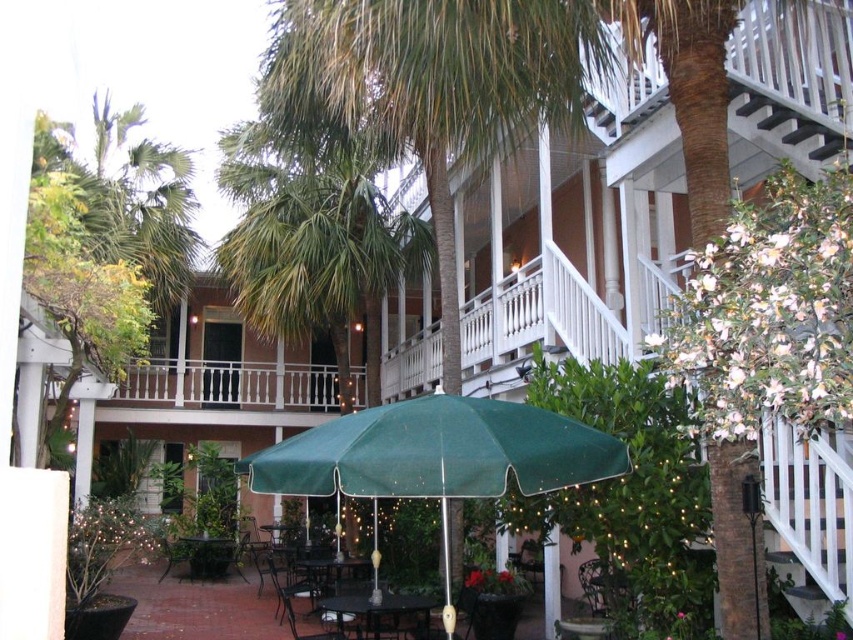
Question: Does metallic green chair at lower center appear on the left side of metallic silver chair at lower center?

Choices:
 (A) yes
 (B) no

Answer: (A)

Question: Which object is the closest to the black glass table at center?

Choices:
 (A) metallic silver chair at lower center
 (B) green fabric umbrella at center
 (C) metallic dark green chair at center
 (D) metallic dark brown table at center

Answer: (A)

Question: Does black glass table at center lie in front of metallic dark brown table at center?

Choices:
 (A) no
 (B) yes

Answer: (B)

Question: Does black glass table at center have a lesser width compared to metallic dark green chair at center?

Choices:
 (A) yes
 (B) no

Answer: (B)

Question: Which object appears farthest from the camera in this image?

Choices:
 (A) green fabric umbrella at center
 (B) metallic dark green chair at center
 (C) metallic green chair at lower center
 (D) metallic dark brown table at center

Answer: (D)

Question: Among these objects, which one is farthest from the camera?

Choices:
 (A) green fabric umbrella at center
 (B) metallic dark green chair at center
 (C) metallic silver chair at lower center
 (D) metallic green chair at lower center

Answer: (D)